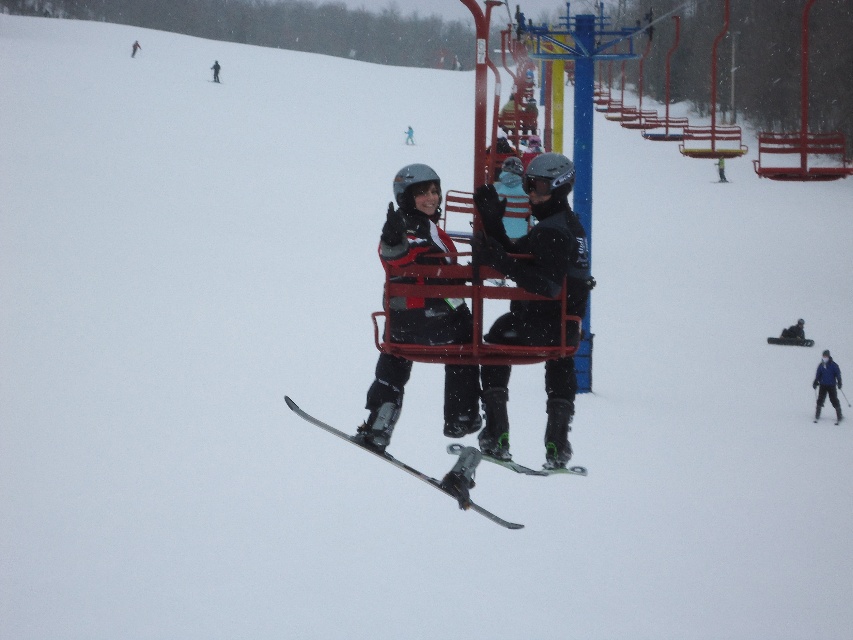
Question: Which object is closer to the camera taking this photo?

Choices:
 (A) metallic skis at center
 (B) green fabric jacket at center
 (C) black ski suit at center
 (D) matte black ski boots at center

Answer: (D)

Question: Based on their relative distances, which object is nearer to the black matte ski at lower right?

Choices:
 (A) blue fabric jacket at lower right
 (B) metallic skis at center
 (C) black ski suit at center

Answer: (A)

Question: Which point is closer to the camera?

Choices:
 (A) metallic skis at center
 (B) matte black jacket at center
 (C) blue fabric jacket at lower right
 (D) green fabric jacket at center

Answer: (B)

Question: Can you confirm if matte black jacket at center is thinner than green fabric jacket at center?

Choices:
 (A) yes
 (B) no

Answer: (A)

Question: Is matte black jacket at center below black matte snowboarder at lower right?

Choices:
 (A) yes
 (B) no

Answer: (B)

Question: Is green fabric jacket at center wider than matte black skier at center?

Choices:
 (A) no
 (B) yes

Answer: (B)